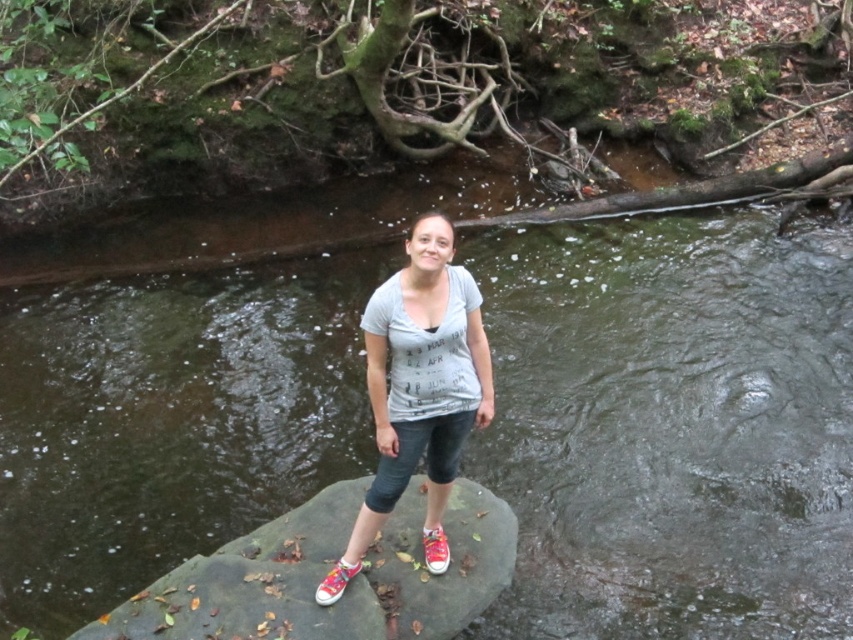
Consider the image. You are a photographer trying to capture the perfect shot of the gray stone at center and the shiny red canvas shoe at center. To ensure both objects are in focus, you need to know their relative sizes. Based on the scene, which object is wider?

The gray stone at center might be wider than the shiny red canvas shoe at center.

From the picture: Based on the coordinates provided, where is the gray stone at center located in the image?

The gray stone at center is located at the coordinates point (325, 572) in the image.

You are a photographer trying to capture the perfect shot of the gray stone at center and the shiny pink canvas shoe at center. Since you want both objects in focus, you need to know their positions relative to each other. Which object is positioned to the left?

The gray stone at center is to the left of the shiny pink canvas shoe at center, so the gray stone at center is positioned to the left.